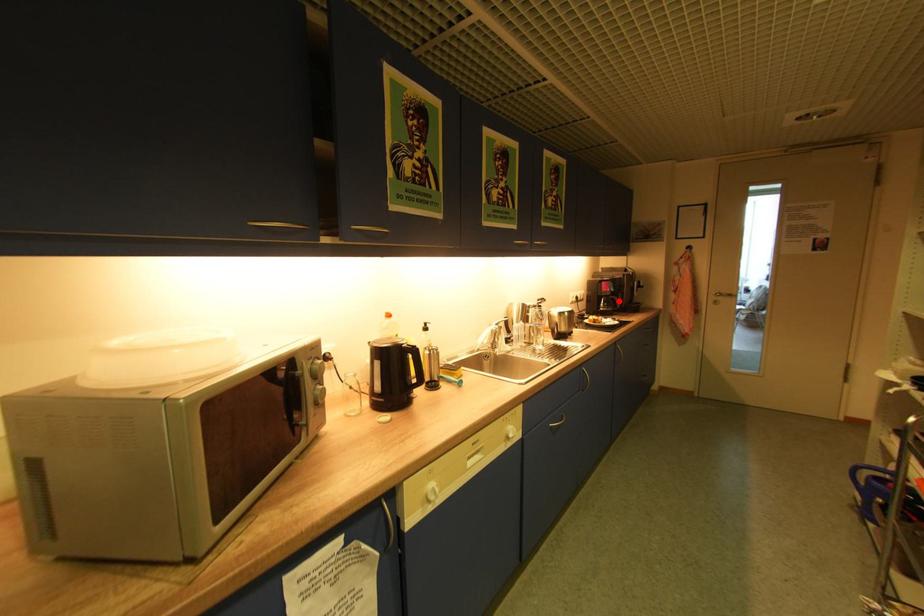
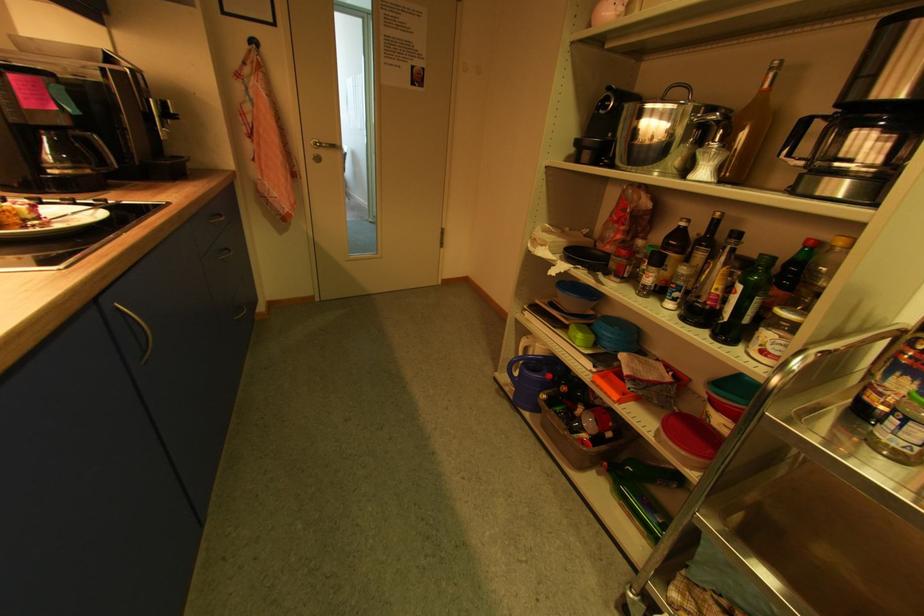
Question: I am providing you with two images of the same scene from different viewpoints. A red point is marked on the first image. Can you still see the location of the red point in image 2?

Choices:
 (A) Yes
 (B) No

Answer: (A)